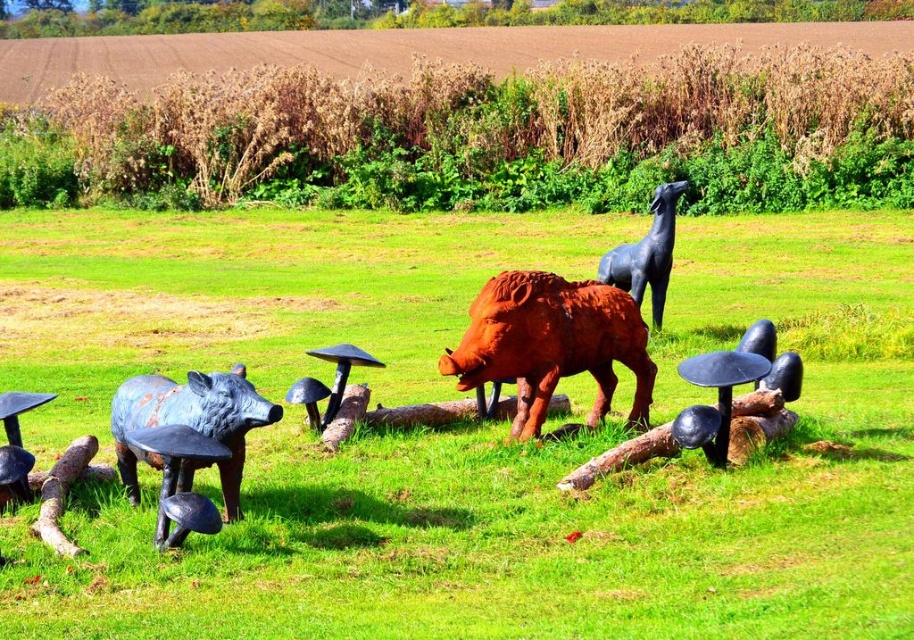
Question: In this image, where is rustic wood boar at center located relative to rusty metal pig at lower left?

Choices:
 (A) right
 (B) left

Answer: (A)

Question: Is rustic wood boar at center further to camera compared to black matte mushroom at center?

Choices:
 (A) yes
 (B) no

Answer: (B)

Question: Which object appears farthest from the camera in this image?

Choices:
 (A) rustic wood boar at center
 (B) brushed metal boar at lower left

Answer: (A)

Question: Which point appears closest to the camera in this image?

Choices:
 (A) (16, 458)
 (B) (165, 406)

Answer: (B)

Question: Can you confirm if rusty metal pig at lower left is wider than brown wood log at center?

Choices:
 (A) yes
 (B) no

Answer: (A)

Question: Considering the real-world distances, which object is closest to the rustic wood boar at center?

Choices:
 (A) rusty wood log at lower left
 (B) black glossy horse at center
 (C) brown wood log at center
 (D) rustic wood animal sculptures at center

Answer: (C)